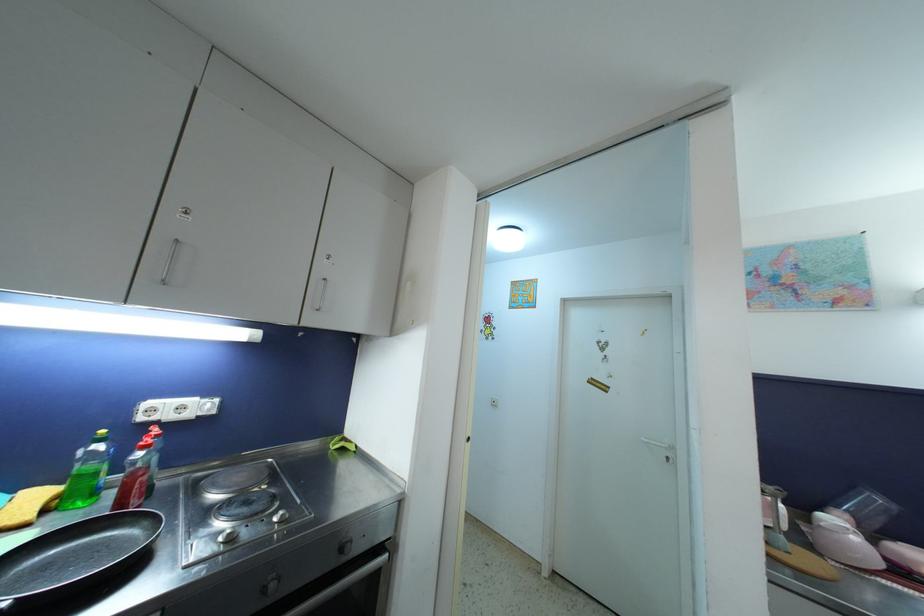
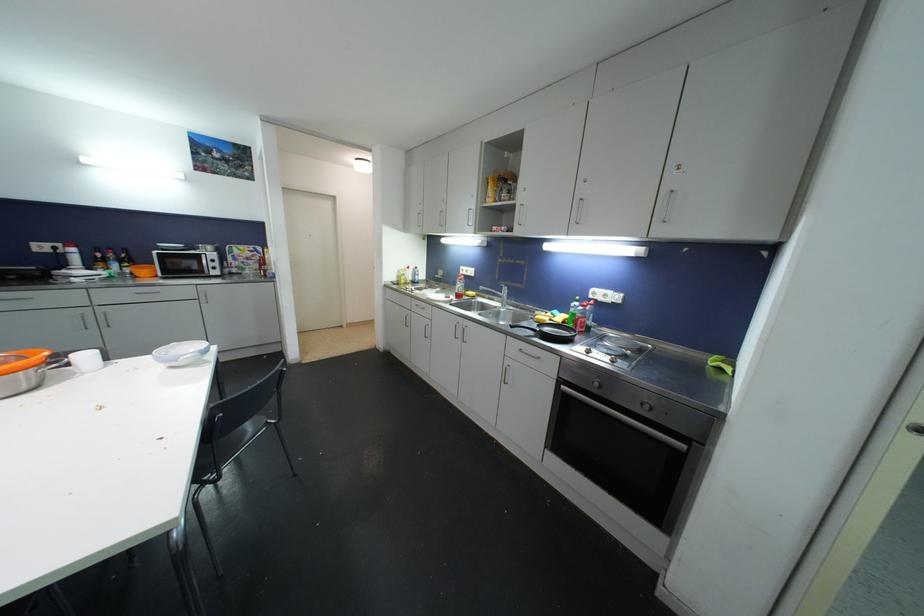
Question: The camera is either moving clockwise (left) or counter-clockwise (right) around the object. The first image is from the beginning of the video and the second image is from the end. Is the camera moving left or right when shooting the video?

Choices:
 (A) Left
 (B) Right

Answer: (B)